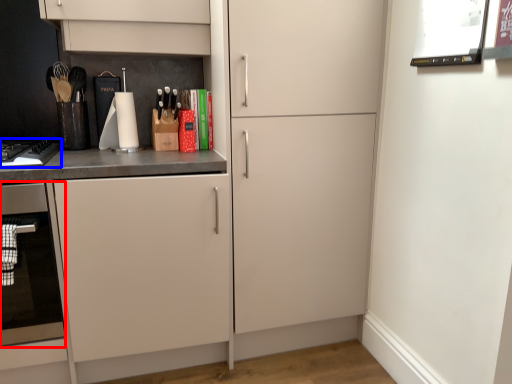
Question: Among these objects, which one is nearest to the camera, oven (highlighted by a red box) or home appliance (highlighted by a blue box)?

Choices:
 (A) oven
 (B) home appliance

Answer: (A)